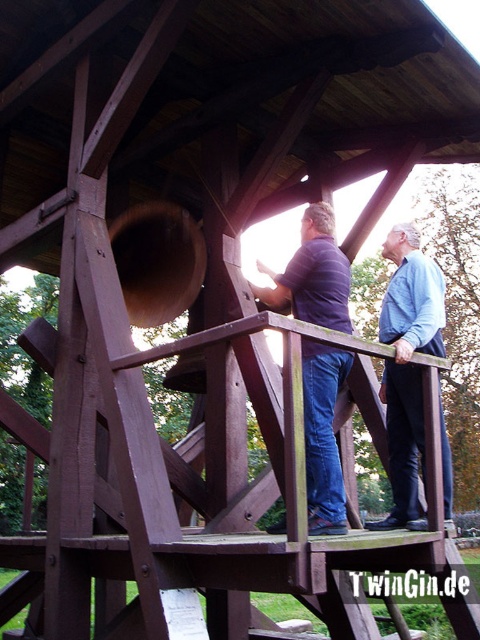
Who is more distant from viewer, (304,355) or (411,435)?

Positioned behind is point (411,435).

Does matte blue shirt at center have a greater width compared to blue denim jeans at upper center?

Correct, the width of matte blue shirt at center exceeds that of blue denim jeans at upper center.

Between point (308, 284) and point (446, 445), which one is positioned behind?

Positioned behind is point (446, 445).

Locate an element on the screen. The height and width of the screenshot is (640, 480). matte blue shirt at center is located at coordinates (323, 436).